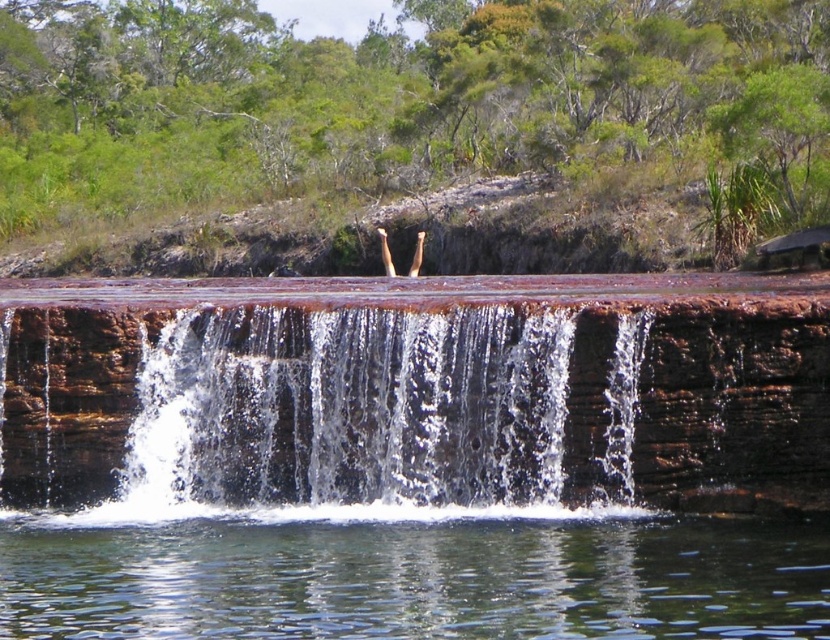
Question: Can you confirm if brown rock waterfall at center is smaller than clear water at center?

Choices:
 (A) yes
 (B) no

Answer: (B)

Question: In this image, where is brown rock waterfall at center located relative to clear water at center?

Choices:
 (A) right
 (B) left

Answer: (B)

Question: Which point is farther from the camera taking this photo?

Choices:
 (A) (243, 452)
 (B) (550, 570)

Answer: (A)

Question: Can you confirm if brown rock waterfall at center is smaller than clear water at center?

Choices:
 (A) no
 (B) yes

Answer: (A)

Question: Among these objects, which one is nearest to the camera?

Choices:
 (A) brown rock waterfall at center
 (B) clear water at center

Answer: (B)